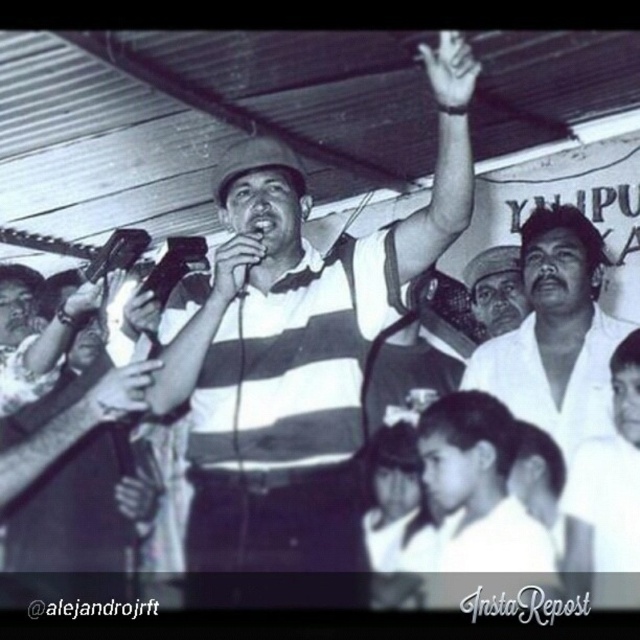
Question: Among these points, which one is farthest from the camera?

Choices:
 (A) (100, 248)
 (B) (260, 240)
 (C) (534, 276)

Answer: (A)

Question: Which is nearer to the metallic microphone at center?

Choices:
 (A) white matte shirt at center
 (B) matte black hand at upper left

Answer: (B)

Question: From the image, what is the correct spatial relationship of white matte hand at upper center in relation to matte black hand at upper center?

Choices:
 (A) below
 (B) above

Answer: (B)

Question: Does striped fabric shirt at center appear on the right side of white matte hand at upper center?

Choices:
 (A) yes
 (B) no

Answer: (B)

Question: From the image, what is the correct spatial relationship of metallic shiny microphone at center in relation to matte black hand at upper left?

Choices:
 (A) above
 (B) below

Answer: (A)

Question: Which object is the closest to the metallic microphone at center?

Choices:
 (A) matte black hand at upper left
 (B) matte black hand at upper center

Answer: (B)